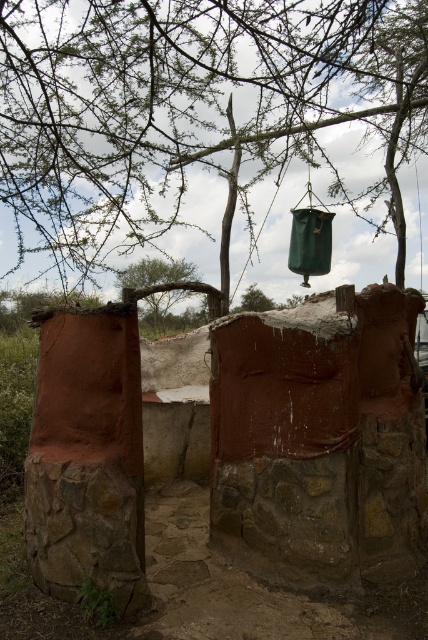
Which is in front, point (309, 97) or point (127, 272)?

Positioned in front is point (309, 97).

Is point (101, 248) positioned in front of point (180, 273)?

Yes, it is.

Image resolution: width=428 pixels, height=640 pixels. Identify the location of green matte hanging pot at upper center. (178, 102).